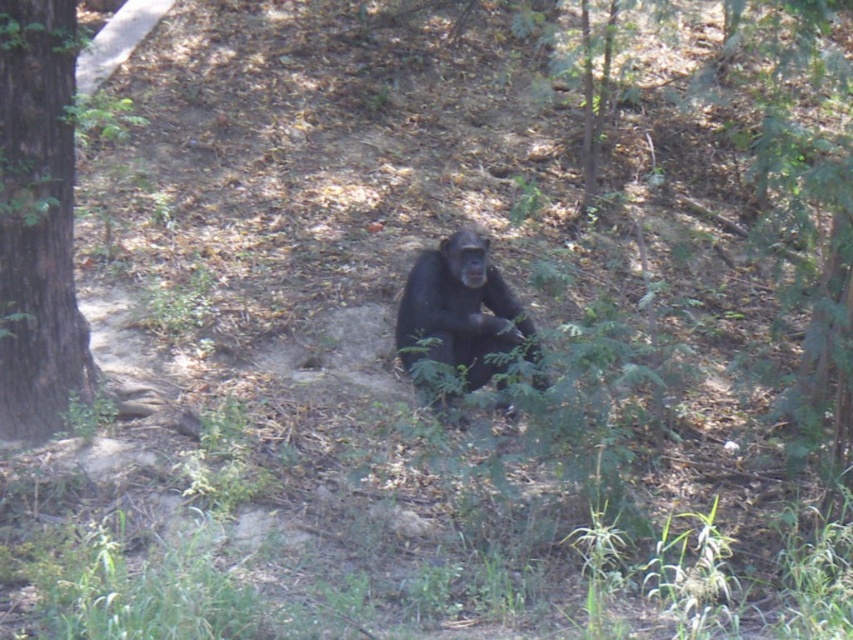
Question: Which object appears closest to the camera in this image?

Choices:
 (A) black fur monkey at center
 (B) brown rough tree at left

Answer: (B)

Question: Does brown rough tree at left have a greater width compared to black fur monkey at center?

Choices:
 (A) yes
 (B) no

Answer: (B)

Question: In this image, where is brown rough tree at left located relative to black fur monkey at center?

Choices:
 (A) left
 (B) right

Answer: (A)

Question: In this image, where is brown rough tree at left located relative to black fur monkey at center?

Choices:
 (A) above
 (B) below

Answer: (A)